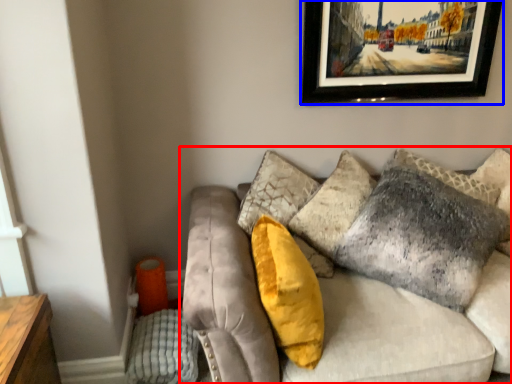
Question: Which object is further to the camera taking this photo, studio couch (highlighted by a red box) or picture frame (highlighted by a blue box)?

Choices:
 (A) studio couch
 (B) picture frame

Answer: (B)